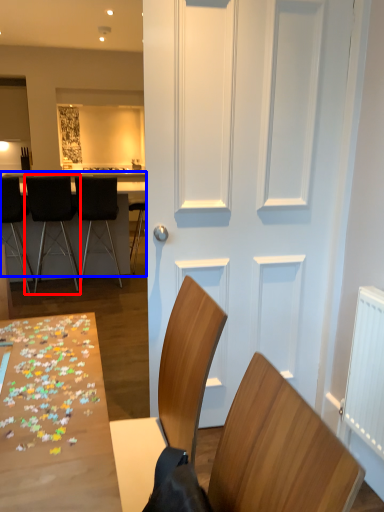
Question: Which of the following is the farthest to the observer, chair (highlighted by a red box) or table (highlighted by a blue box)?

Choices:
 (A) chair
 (B) table

Answer: (A)